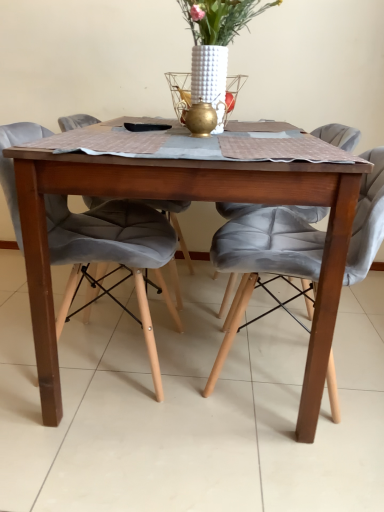
Question: Is wooden table at center closer to camera compared to white textured vase at center?

Choices:
 (A) no
 (B) yes

Answer: (B)

Question: Considering the relative positions of wooden table at center and white textured vase at center in the image provided, is wooden table at center to the right of white textured vase at center from the viewer's perspective?

Choices:
 (A) yes
 (B) no

Answer: (B)

Question: Does wooden table at center lie behind white textured vase at center?

Choices:
 (A) yes
 (B) no

Answer: (B)

Question: Would you say wooden table at center is a long distance from white textured vase at center?

Choices:
 (A) yes
 (B) no

Answer: (B)

Question: Can you confirm if wooden table at center is taller than white textured vase at center?

Choices:
 (A) no
 (B) yes

Answer: (B)

Question: Would you say white textured vase at center is to the left or to the right of wooden table at center in the picture?

Choices:
 (A) right
 (B) left

Answer: (A)

Question: In terms of size, does white textured vase at center appear bigger or smaller than wooden table at center?

Choices:
 (A) small
 (B) big

Answer: (A)

Question: From a real-world perspective, is white textured vase at center above or below wooden table at center?

Choices:
 (A) above
 (B) below

Answer: (A)

Question: In terms of height, does white textured vase at center look taller or shorter compared to wooden table at center?

Choices:
 (A) tall
 (B) short

Answer: (B)

Question: Considering the relative positions of velvet grey chair at center, the second chair positioned from the right, and white textured vase at center in the image provided, is velvet grey chair at center, the second chair positioned from the right, to the left or to the right of white textured vase at center?

Choices:
 (A) right
 (B) left

Answer: (B)

Question: Considering the positions of velvet grey chair at center, which is counted as the first chair, starting from the left, and white textured vase at center in the image, is velvet grey chair at center, which is counted as the first chair, starting from the left, bigger or smaller than white textured vase at center?

Choices:
 (A) small
 (B) big

Answer: (B)

Question: Considering the positions of velvet grey chair at center, which is counted as the first chair, starting from the left, and white textured vase at center in the image, is velvet grey chair at center, which is counted as the first chair, starting from the left, taller or shorter than white textured vase at center?

Choices:
 (A) short
 (B) tall

Answer: (B)

Question: Is point (64, 244) closer or farther from the camera than point (203, 62)?

Choices:
 (A) closer
 (B) farther

Answer: (A)

Question: Is white textured vase at center taller or shorter than velvet grey chair at center, which is counted as the first chair, starting from the left?

Choices:
 (A) tall
 (B) short

Answer: (B)

Question: In the image, is white textured vase at center on the left side or the right side of velvet grey chair at center, which is counted as the first chair, starting from the left?

Choices:
 (A) right
 (B) left

Answer: (A)